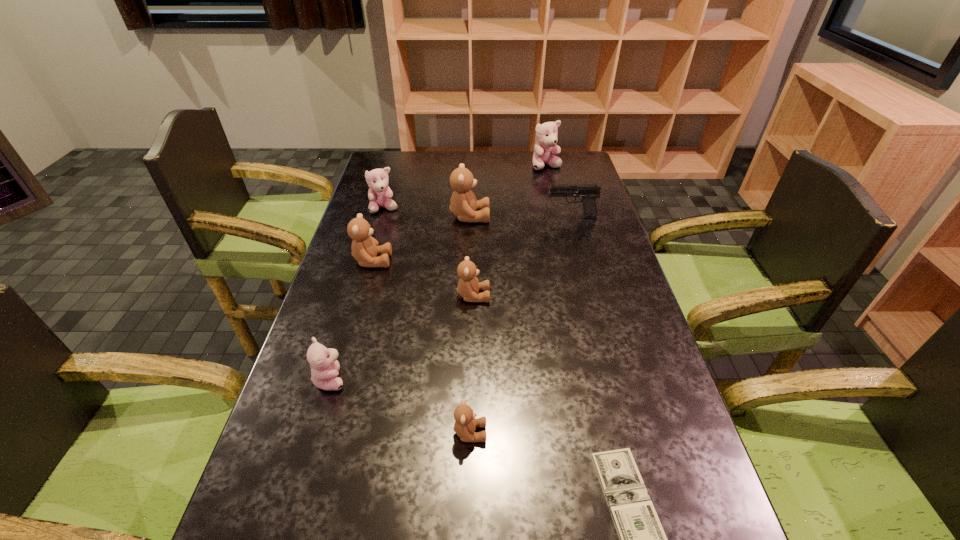
Where is `the smallest pink teddy bear`? the smallest pink teddy bear is located at coordinates (323, 362).

Locate an element on the screen. This screenshot has width=960, height=540. the eighth tallest object is located at coordinates (465, 424).

Where is `the smallest brown teddy bear`? The image size is (960, 540). the smallest brown teddy bear is located at coordinates click(465, 424).

Locate an element on the screen. The width and height of the screenshot is (960, 540). vacant space located 0.300m at the face of the farthest object is located at coordinates (558, 217).

Find the location of a particular element. vacant space located on the face of the farthest brown teddy bear is located at coordinates (540, 217).

Locate an element on the screen. This screenshot has height=540, width=960. vacant area situated 0.370m at the face of the second nearest pink teddy bear is located at coordinates (360, 291).

In order to click on free region located 0.270m on the face of the second farthest brown teddy bear in this screenshot , I will do `click(481, 261)`.

The height and width of the screenshot is (540, 960). Find the location of `vacant space located aim along the barrel of the pistol`. vacant space located aim along the barrel of the pistol is located at coordinates (499, 217).

Locate an element on the screen. The width and height of the screenshot is (960, 540). free space located aim along the barrel of the pistol is located at coordinates (499, 217).

Find the location of `vacant space situated aim along the barrel of the pistol`. vacant space situated aim along the barrel of the pistol is located at coordinates (525, 217).